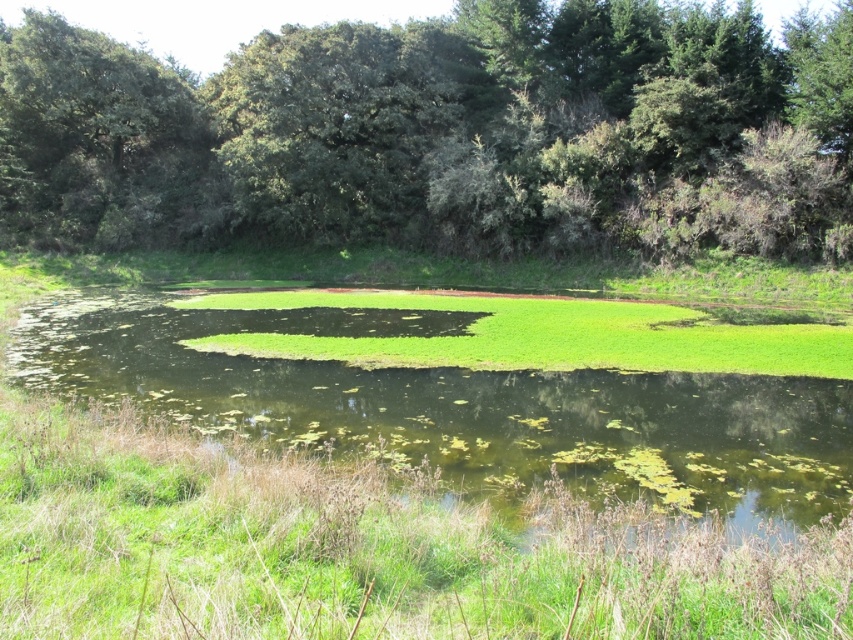
You are standing at the edge of the pond and see two points marked in the scene. Which point is closer to you, point (648,458) or point (38,76)?

Point (648,458) is in front of point (38,76), so it is closer to you.

You are planning to place a small wooden boat in the pond. The boat requires a space wider than the green leafy tree at upper left to fit. Can the green algae at center provide enough space for the boat?

The green algae at center has a width larger than the green leafy tree at upper left, so yes, the boat can fit in the space provided by the green algae at center.

You are standing at the origin point of the image. Which direction should you move to reach the green leafy trees at upper center?

The green leafy trees at upper center are located at point (444, 132), so you should move towards the upper center direction to reach them.